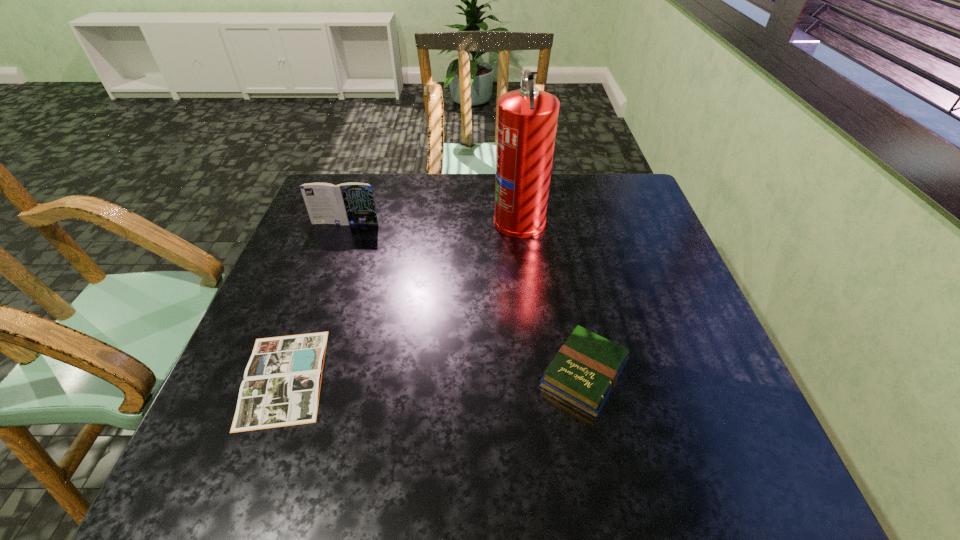
Find the location of a particular element. The height and width of the screenshot is (540, 960). free spot located 0.320m on the back of the rightmost book is located at coordinates (559, 244).

This screenshot has width=960, height=540. Identify the location of vacant space positioned 0.080m on the back of the shortest object. (311, 306).

Image resolution: width=960 pixels, height=540 pixels. What are the coordinates of `object positioned at the far edge` in the screenshot? It's located at (527, 118).

The width and height of the screenshot is (960, 540). In order to click on vacant space at the far edge in this screenshot , I will do `click(400, 183)`.

The width and height of the screenshot is (960, 540). In the image, there is a desktop. Identify the location of vacant space at the near edge. (589, 470).

Identify the location of free space at the left edge of the desktop. (278, 307).

At what (x,y) coordinates should I click in order to perform the action: click on vacant space at the right edge of the desktop. Please return your answer as a coordinate pair (x, y). The width and height of the screenshot is (960, 540). Looking at the image, I should click on (690, 433).

Where is `vacant space at the far right corner`? vacant space at the far right corner is located at coordinates (648, 201).

What are the coordinates of `free spot at the near right corner of the desktop` in the screenshot? It's located at (701, 455).

The width and height of the screenshot is (960, 540). What are the coordinates of `free space that is in between the shortest object and the third shortest object` in the screenshot? It's located at (315, 300).